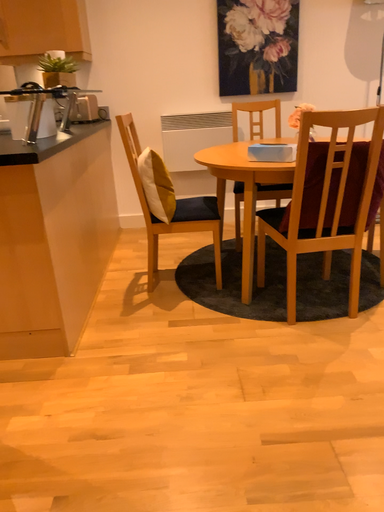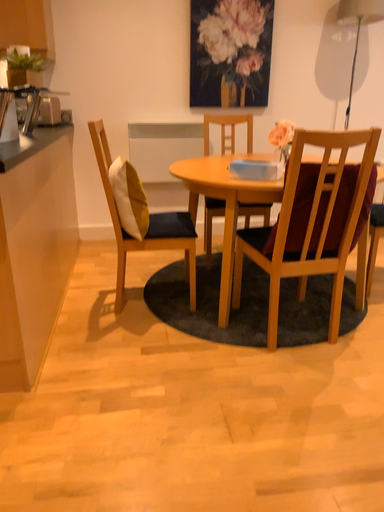
Question: Which way did the camera rotate in the video?

Choices:
 (A) rotated left
 (B) rotated right

Answer: (B)